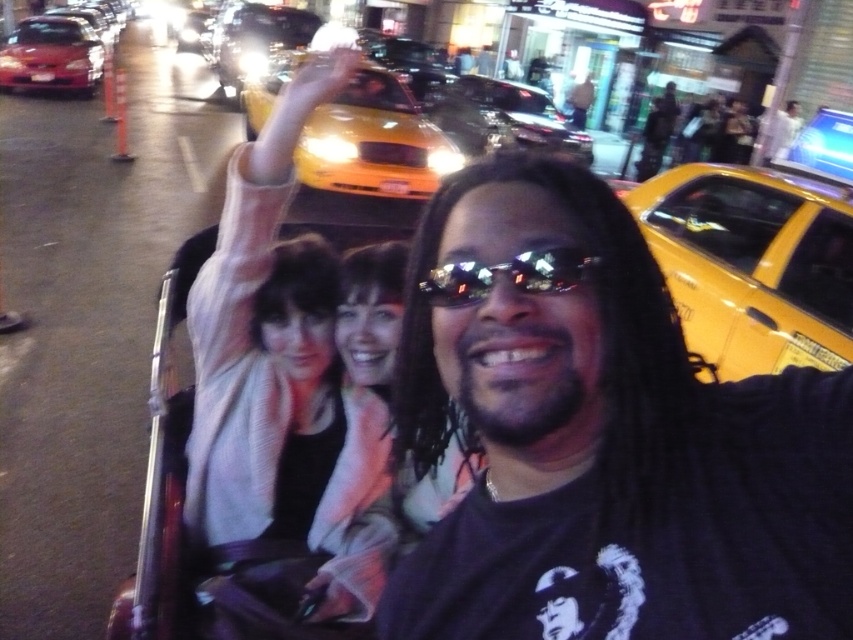
You are a fashion designer who wants to create a scarf that matches the width of the shiny red sedan at upper left. Given that the light pink fabric scarf at center is narrower than the sedan, what should you do to ensure the scarf matches the sedan?

The light pink fabric scarf at center is narrower than the shiny red sedan at upper left. To match the sedan, you should create a scarf wider than the light pink fabric scarf at center.